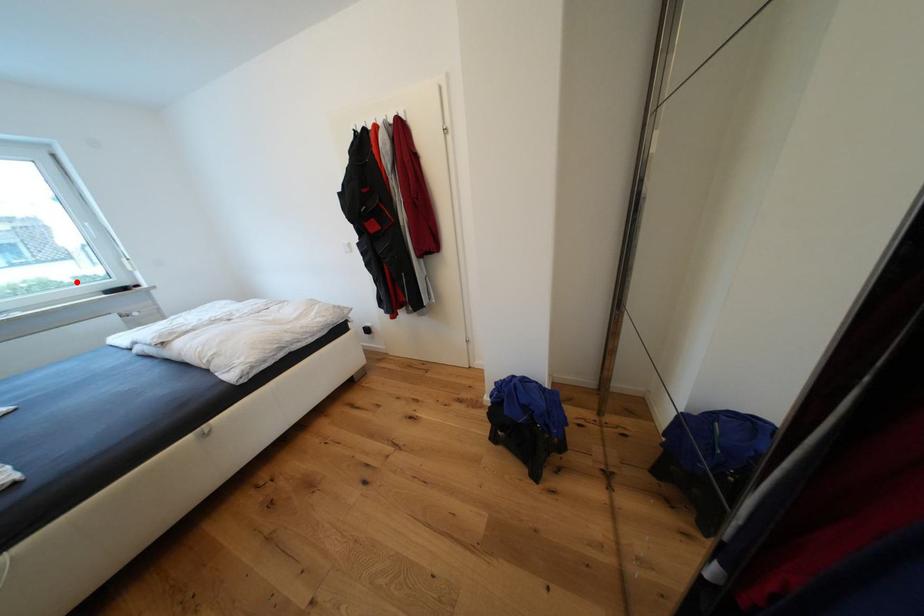
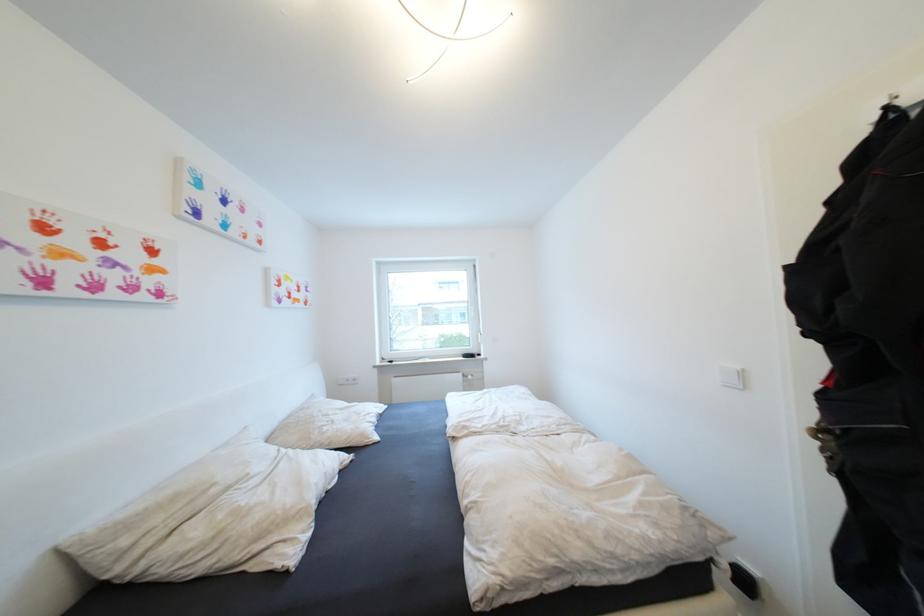
Locate, in the second image, the point that corresponds to the highlighted location in the first image.

(476, 338)